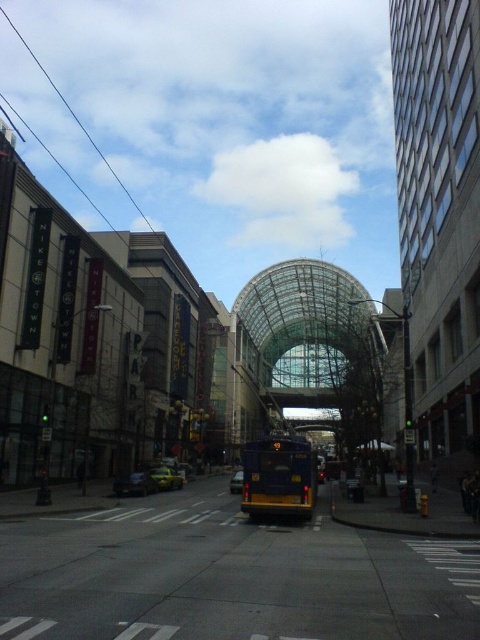
You are a delivery person needing to park your vehicle. You have a yellow matte bus at center and a metallic silver car at lower left. Which vehicle takes up more space when parked?

The yellow matte bus at center is bigger than the metallic silver car at lower left, so it takes up more space when parked.

You are standing at the center of the street looking towards the arched structure. There are two points marked on the structure. Which point, point 1 at coordinates (x=146, y=476) or point 2 at coordinates (x=238, y=477), is closer to you?

Point 1 at coordinates (x=146, y=476) is closer to you than point 2 at coordinates (x=238, y=477).

You are a pedestrian trying to cross the street at the intersection near the arched structure. You see a yellow matte bus at center and a yellow matte car at center. Which vehicle is closer to the arched structure?

The yellow matte bus at center is positioned over the yellow matte car at center, meaning it is closer to the arched structure.